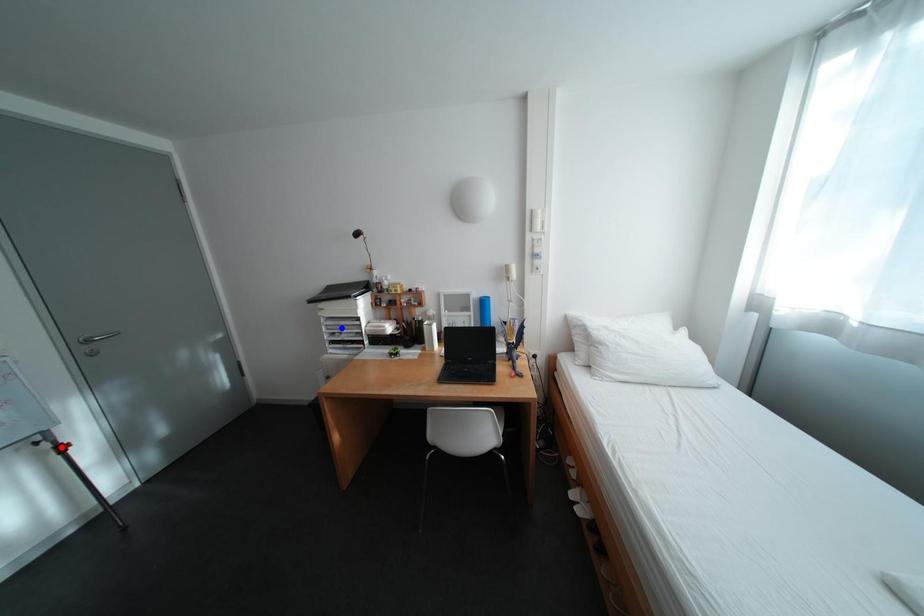
Question: In the image, two points are highlighted. Which point is nearer to the camera? Reply with the corresponding letter.

Choices:
 (A) blue point
 (B) red point

Answer: (B)